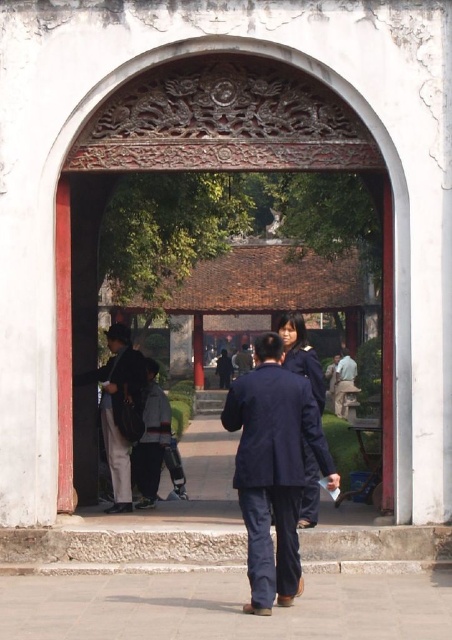
Does navy blue suit at center lie behind navy blue fabric business suit at center?

No, it is not.

Is point (329, 472) behind point (315, 371)?

No, (329, 472) is in front of (315, 371).

Identify the location of navy blue suit at center. (273, 468).

Which is more to the right, dark blue fabric jacket at center or navy blue fabric business suit at center?

navy blue fabric business suit at center

Can you confirm if dark blue fabric jacket at center is positioned below navy blue fabric business suit at center?

Correct, dark blue fabric jacket at center is located below navy blue fabric business suit at center.

The image size is (452, 640). Identify the location of dark blue fabric jacket at center. (122, 410).

Where is `dark blue fabric jacket at center`? The image size is (452, 640). dark blue fabric jacket at center is located at coordinates (122, 410).

Does light brown leather jacket at center have a greater height compared to dark blue uniform at center?

Yes, light brown leather jacket at center is taller than dark blue uniform at center.

Can you confirm if light brown leather jacket at center is positioned above dark blue uniform at center?

Incorrect, light brown leather jacket at center is not positioned above dark blue uniform at center.

Does point (338, 412) lie in front of point (241, 364)?

That is True.

Where is `light brown leather jacket at center`? Image resolution: width=452 pixels, height=640 pixels. light brown leather jacket at center is located at coordinates (343, 381).